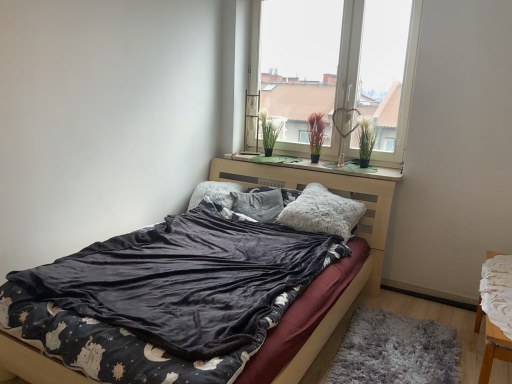
Image resolution: width=512 pixels, height=384 pixels. Describe the element at coordinates (269, 130) in the screenshot. I see `green matte plant at center, the 3th plant positioned from the right` at that location.

Where is `green matte plant at upper right, which appears as the 3th plant when viewed from the left`? This screenshot has width=512, height=384. green matte plant at upper right, which appears as the 3th plant when viewed from the left is located at coordinates (366, 138).

Image resolution: width=512 pixels, height=384 pixels. Describe the element at coordinates (366, 138) in the screenshot. I see `green matte plant at upper right, which appears as the 1th plant when viewed from the right` at that location.

Describe the element at coordinates (357, 231) in the screenshot. I see `velvet dark gray bed at center` at that location.

What do you see at coordinates (494, 350) in the screenshot? The image size is (512, 384). I see `white lace chair at lower right` at bounding box center [494, 350].

What do you see at coordinates (316, 134) in the screenshot? The image size is (512, 384). I see `burgundy matte plant at center, which ranks as the second plant in right-to-left order` at bounding box center [316, 134].

This screenshot has height=384, width=512. In order to click on burgundy matte plant at center, which ranks as the second plant in right-to-left order in this screenshot , I will do `click(316, 134)`.

At what (x,y) coordinates should I click in order to perform the action: click on gray shaggy rug at lower right. Please return your answer as a coordinate pair (x, y). The image size is (512, 384). Looking at the image, I should click on (395, 351).

Where is `transparent glass window at upper center`? This screenshot has width=512, height=384. transparent glass window at upper center is located at coordinates (334, 73).

Can you confirm if green felt at center is shorter than green matte plant at upper right, which appears as the 1th plant when viewed from the right?

Yes, green felt at center is shorter than green matte plant at upper right, which appears as the 1th plant when viewed from the right.

Is green felt at center oriented away from green matte plant at upper right, which appears as the 3th plant when viewed from the left?

No, green felt at center's orientation is not away from green matte plant at upper right, which appears as the 3th plant when viewed from the left.

From the image's perspective, between green felt at center and green matte plant at upper right, which appears as the 3th plant when viewed from the left, which one is located above?

green matte plant at upper right, which appears as the 3th plant when viewed from the left, is shown above in the image.

Looking at this image, is burgundy matte plant at center, which ranks as the second plant in right-to-left order, behind velvet dark gray bed at center?

Yes, burgundy matte plant at center, which ranks as the second plant in right-to-left order, is further from the camera.

Is burgundy matte plant at center, placed as the second plant when sorted from left to right, not near velvet dark gray bed at center?

Actually, burgundy matte plant at center, placed as the second plant when sorted from left to right, and velvet dark gray bed at center are a little close together.

From a real-world perspective, between burgundy matte plant at center, placed as the second plant when sorted from left to right, and velvet dark gray bed at center, who is vertically lower?

velvet dark gray bed at center.

Considering the relative positions of burgundy matte plant at center, placed as the second plant when sorted from left to right, and velvet dark gray bed at center in the image provided, is burgundy matte plant at center, placed as the second plant when sorted from left to right, to the right of velvet dark gray bed at center from the viewer's perspective?

Indeed, burgundy matte plant at center, placed as the second plant when sorted from left to right, is positioned on the right side of velvet dark gray bed at center.

Considering the sizes of objects green matte plant at upper right, which appears as the 1th plant when viewed from the right, and velvet dark gray bed at center in the image provided, who is bigger, green matte plant at upper right, which appears as the 1th plant when viewed from the right, or velvet dark gray bed at center?

With larger size is velvet dark gray bed at center.

Based on the photo, does green matte plant at upper right, which appears as the 3th plant when viewed from the left, turn towards velvet dark gray bed at center?

No.

Measure the distance between green matte plant at upper right, which appears as the 3th plant when viewed from the left, and velvet dark gray bed at center.

25.66 inches.

Which object is further away from the camera, green matte plant at upper right, which appears as the 3th plant when viewed from the left, or velvet dark gray bed at center?

green matte plant at upper right, which appears as the 3th plant when viewed from the left, is more distant.

From a real-world perspective, count 1st pillows upward from the velvet dark gray bed at center and point to it. Please provide its 2D coordinates.

[(215, 193)]

Considering the sizes of objects fluffy gray pillow at center, the 3th pillow viewed from the right, and velvet dark gray bed at center in the image provided, who is bigger, fluffy gray pillow at center, the 3th pillow viewed from the right, or velvet dark gray bed at center?

Bigger between the two is velvet dark gray bed at center.

From a real-world perspective, is fluffy gray pillow at center, marked as the first pillow in a left-to-right arrangement, below velvet dark gray bed at center?

No, from a real-world perspective, fluffy gray pillow at center, marked as the first pillow in a left-to-right arrangement, is not under velvet dark gray bed at center.

Based on the photo, in terms of size, does velvet dark gray bed at center appear bigger or smaller than green felt at center?

Clearly, velvet dark gray bed at center is larger in size than green felt at center.

Considering the points (32, 365) and (396, 177), which point is in front, point (32, 365) or point (396, 177)?

The point (32, 365) is more forward.

Is velvet dark gray bed at center at the left side of green felt at center?

Indeed, velvet dark gray bed at center is positioned on the left side of green felt at center.

Is velvet dark gray bed at center beside green felt at center?

velvet dark gray bed at center is not next to green felt at center, and they're not touching.

From a real-world perspective, relative to green matte plant at center, which is counted as the 1th plant, starting from the left, is gray shaggy rug at lower right vertically above or below?

gray shaggy rug at lower right is below green matte plant at center, which is counted as the 1th plant, starting from the left.

Considering the positions of objects gray shaggy rug at lower right and green matte plant at center, which is counted as the 1th plant, starting from the left, in the image provided, who is behind, gray shaggy rug at lower right or green matte plant at center, which is counted as the 1th plant, starting from the left,?

Positioned behind is green matte plant at center, which is counted as the 1th plant, starting from the left.

Is gray shaggy rug at lower right in contact with green matte plant at center, the 3th plant positioned from the right?

No, gray shaggy rug at lower right is not beside green matte plant at center, the 3th plant positioned from the right.

From a real-world perspective, is fluffy gray pillow at center, the 2th pillow viewed from the right, positioned under green matte plant at upper right, which appears as the 1th plant when viewed from the right, based on gravity?

Yes, from a real-world perspective, fluffy gray pillow at center, the 2th pillow viewed from the right, is beneath green matte plant at upper right, which appears as the 1th plant when viewed from the right.

Which of these two, fluffy gray pillow at center, which is counted as the second pillow, starting from the left, or green matte plant at upper right, which appears as the 3th plant when viewed from the left, is wider?

fluffy gray pillow at center, which is counted as the second pillow, starting from the left.

Which of these two, fluffy gray pillow at center, which is counted as the second pillow, starting from the left, or green matte plant at upper right, which appears as the 3th plant when viewed from the left, is smaller?

With smaller size is green matte plant at upper right, which appears as the 3th plant when viewed from the left.

Could you measure the distance between fluffy gray pillow at center, the 2th pillow viewed from the right, and green matte plant at upper right, which appears as the 3th plant when viewed from the left?

fluffy gray pillow at center, the 2th pillow viewed from the right, and green matte plant at upper right, which appears as the 3th plant when viewed from the left, are 34.64 inches apart from each other.

Locate an element on the screen. The width and height of the screenshot is (512, 384). window sill below the green matte plant at upper right, which appears as the 3th plant when viewed from the left (from a real-world perspective) is located at coordinates (320, 166).

Where is `the 2nd plant to the right when counting from the velvet dark gray bed at center`? This screenshot has width=512, height=384. the 2nd plant to the right when counting from the velvet dark gray bed at center is located at coordinates (316, 134).

Estimate the real-world distances between objects in this image. Which object is further from green felt at center, fluffy gray pillow at center, the 3th pillow viewed from the right, or fluffy gray pillow at center, the 1th pillow viewed from the right?

fluffy gray pillow at center, the 3th pillow viewed from the right, is further to green felt at center.

When comparing their distances from green felt at center, does transparent glass window at upper center or fluffy gray pillow at center, the 1th pillow viewed from the right, seem closer?

Among the two, fluffy gray pillow at center, the 1th pillow viewed from the right, is located nearer to green felt at center.

Based on their spatial positions, is burgundy matte plant at center, placed as the second plant when sorted from left to right, or white lace chair at lower right closer to green felt at center?

The object closer to green felt at center is burgundy matte plant at center, placed as the second plant when sorted from left to right.

Consider the image. Based on their spatial positions, is fluffy gray pillow at center, marked as the first pillow in a left-to-right arrangement, or fluffy gray pillow at center, placed as the third pillow when sorted from left to right, further from white lace chair at lower right?

fluffy gray pillow at center, marked as the first pillow in a left-to-right arrangement.

From the image, which object appears to be farther from white lace chair at lower right, velvet dark gray bed at center or green matte plant at upper right, which appears as the 3th plant when viewed from the left?

green matte plant at upper right, which appears as the 3th plant when viewed from the left, is positioned further to the anchor white lace chair at lower right.

Which object lies nearer to the anchor point green felt at center, green matte plant at upper right, which appears as the 1th plant when viewed from the right, or fluffy gray pillow at center, the 3th pillow viewed from the right?

green matte plant at upper right, which appears as the 1th plant when viewed from the right, is closer to green felt at center.

Which object lies nearer to the anchor point gray shaggy rug at lower right, white lace chair at lower right or green matte plant at center, which is counted as the 1th plant, starting from the left?

The object closer to gray shaggy rug at lower right is white lace chair at lower right.

Looking at the image, which one is located closer to transparent glass window at upper center, velvet dark gray bed at center or white lace chair at lower right?

velvet dark gray bed at center is closer to transparent glass window at upper center.

This screenshot has width=512, height=384. What are the coordinates of `chair between velvet dark gray bed at center and fluffy gray pillow at center, marked as the first pillow in a left-to-right arrangement, along the z-axis` in the screenshot? It's located at (494, 350).

Where is `window sill between white lace chair at lower right and fluffy gray pillow at center, which is counted as the second pillow, starting from the left, from front to back`? The image size is (512, 384). window sill between white lace chair at lower right and fluffy gray pillow at center, which is counted as the second pillow, starting from the left, from front to back is located at coordinates (320, 166).

Locate an element on the screen. Image resolution: width=512 pixels, height=384 pixels. pillow positioned between gray shaggy rug at lower right and green felt at center from near to far is located at coordinates (322, 212).

At what (x,y) coordinates should I click in order to perform the action: click on mat positioned between white lace chair at lower right and green matte plant at upper right, which appears as the 1th plant when viewed from the right, from near to far. Please return your answer as a coordinate pair (x, y). Image resolution: width=512 pixels, height=384 pixels. Looking at the image, I should click on (395, 351).